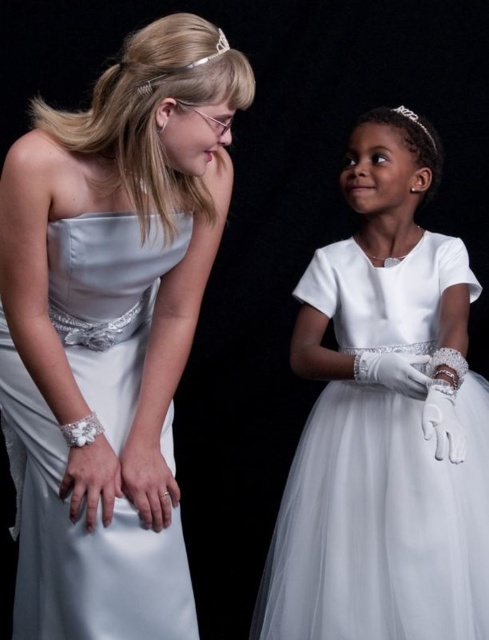
Based on the scene description, where is the satin dress at center located in 2D coordinates?

The satin dress at center is located at the 2D coordinates point (111,332).

You are a photographer setting up for a photoshoot. You need to ensure that both the satin dress at center and the white tulle dress at center are visible in the frame. Based on their positions, which dress should you focus on to ensure the other remains in the background?

The satin dress at center is in front of the white tulle dress at center, so focusing on the satin dress at center will keep the white tulle dress at center visible in the background.

You are a photographer adjusting your camera settings to capture the two subjects in the image. Since you want to focus on the closer object first, which one should you prioritize focusing on between the satin dress at center and the clear crystal tiara at upper center?

The satin dress at center is further to the viewer than the clear crystal tiara at upper center, so you should prioritize focusing on the satin dress at center first as it is closer to you.